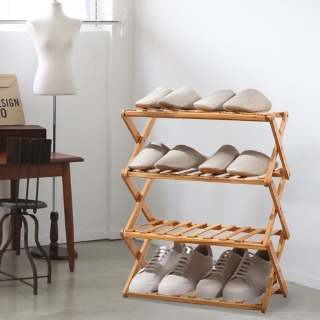
Locate an element on the screen. This screenshot has height=320, width=320. wooden slats from the shelf that does not have any footwear on it is located at coordinates (144, 224), (151, 227), (167, 230), (180, 232), (194, 234), (211, 234), (226, 236), (244, 237), (260, 240).